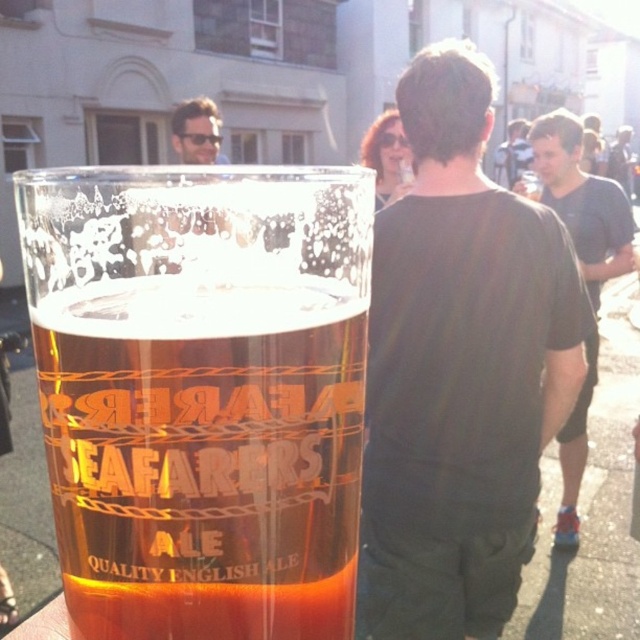
Consider the image. You are at a social event and want to know if the translucent glass mug at center can fit inside the black matte shirt at center. Based on their sizes, what do you think?

The translucent glass mug at center is smaller than the black matte shirt at center, so it can fit inside.

In the scene shown: You are a photographer trying to capture a candid shot of the black matte shirt at center and the dark brown leather jacket at upper center. You want to ensure both subjects are fully visible in the frame. Based on their sizes, do you think you can fit both into the same photo without cropping either of them?

The black matte shirt at center might be wider than dark brown leather jacket at upper center, so it is possible to fit both into the same photo without cropping either of them, provided the camera is positioned to accommodate the wider object.